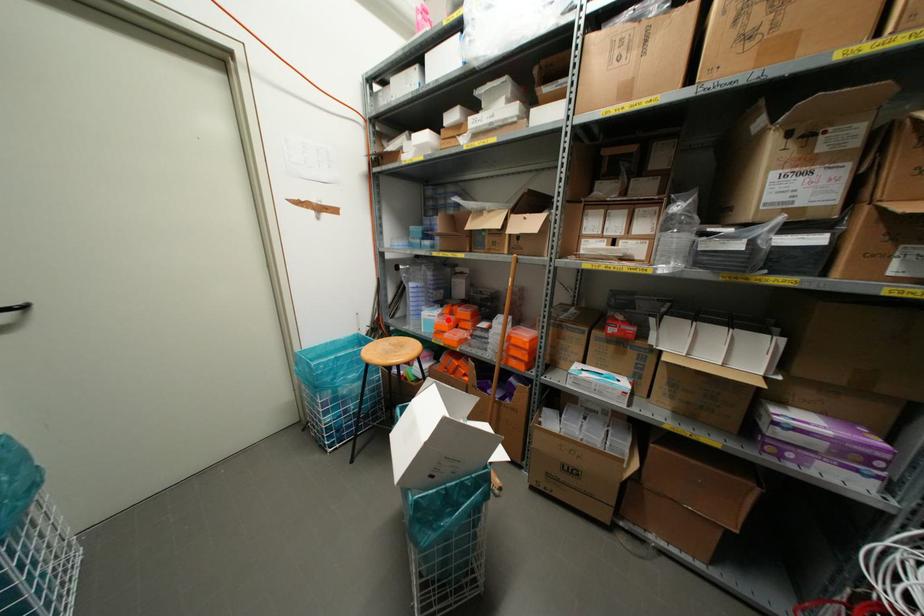
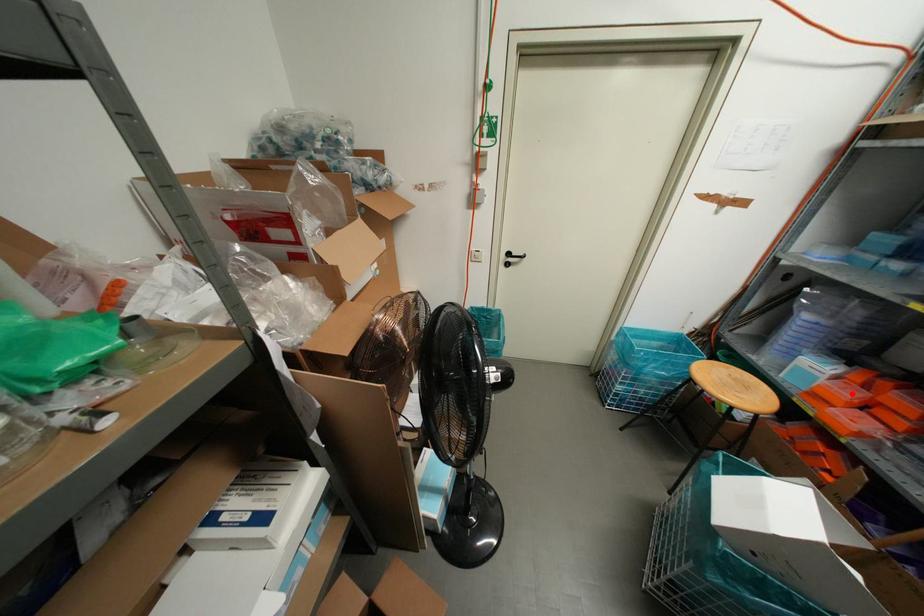
I am providing you with two images of the same scene from different viewpoints. A red point is marked on the first image and another point is marked on the second image. Is the marked point in image1 the same physical position as the marked point in image2?

Yes